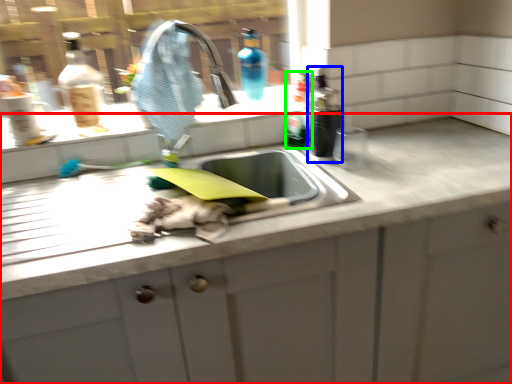
Question: Which object is positioned farthest from countertop (highlighted by a red box)? Select from bottle (highlighted by a blue box) and bottle (highlighted by a green box).

Choices:
 (A) bottle
 (B) bottle

Answer: (B)